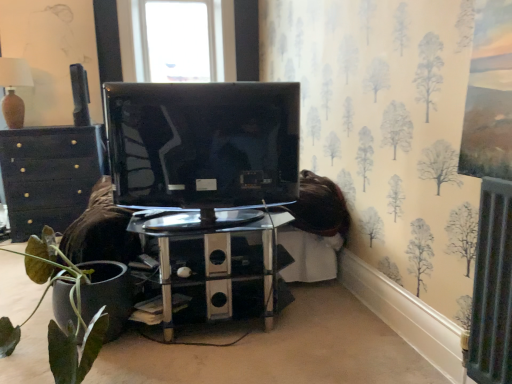
Question: From a real-world perspective, is metallic gray speaker at upper left physically located above or below matte black chest of drawers at left?

Choices:
 (A) below
 (B) above

Answer: (B)

Question: Is point (83, 112) closer or farther from the camera than point (10, 223)?

Choices:
 (A) closer
 (B) farther

Answer: (B)

Question: Which of these objects is positioned closest to the glossy black tv at center?

Choices:
 (A) matte brown lampshade at upper left
 (B) metallic gray speaker at upper left
 (C) matte black chest of drawers at left
 (D) green matte plant at lower left
 (E) polished chrome table at center

Answer: (E)

Question: Estimate the real-world distances between objects in this image. Which object is farther from the glossy black tv at center?

Choices:
 (A) metallic gray speaker at upper left
 (B) green matte plant at lower left
 (C) matte black chest of drawers at left
 (D) matte brown lampshade at upper left
 (E) polished chrome table at center

Answer: (D)